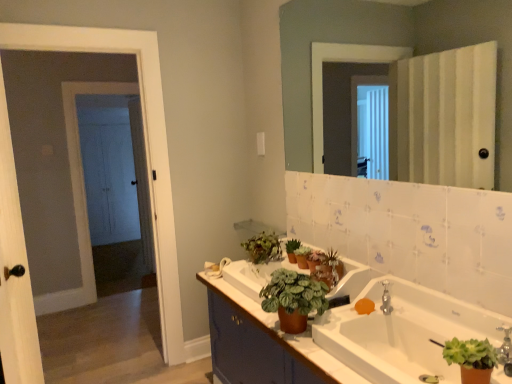
Measure the distance between green matte plant at lower right, which ranks as the first houseplant in right-to-left order, and camera.

green matte plant at lower right, which ranks as the first houseplant in right-to-left order, and camera are 1.13 meters apart.

Measure the distance between point (x=311, y=0) and camera.

Point (x=311, y=0) is 7.84 feet away from camera.

Identify the location of white wooden door at left. (82, 166).

Where is `green matte plant at upper center, the 2th houseplant when ordered from right to left`? This screenshot has width=512, height=384. green matte plant at upper center, the 2th houseplant when ordered from right to left is located at coordinates (292, 249).

Where is `green matte plant at center, which ranks as the second houseplant in back-to-front order`? green matte plant at center, which ranks as the second houseplant in back-to-front order is located at coordinates (263, 248).

Image resolution: width=512 pixels, height=384 pixels. What do you see at coordinates (263, 248) in the screenshot?
I see `green matte plant at center, the third houseplant when ordered from front to back` at bounding box center [263, 248].

Where is `green matte plant at lower right, which is the 1th houseplant in front-to-back order`? The image size is (512, 384). green matte plant at lower right, which is the 1th houseplant in front-to-back order is located at coordinates (471, 359).

Is green matte plant at upper center, the 2th houseplant when ordered from right to left, bigger or smaller than white matte towel bar at center?

green matte plant at upper center, the 2th houseplant when ordered from right to left, is smaller than white matte towel bar at center.

Considering the relative positions of green matte plant at upper center, the 2th houseplant when ordered from right to left, and white matte towel bar at center in the image provided, is green matte plant at upper center, the 2th houseplant when ordered from right to left, in front of white matte towel bar at center?

Yes, green matte plant at upper center, the 2th houseplant when ordered from right to left, is closer to the camera.

From a real-world perspective, which object stands above the other?

green matte plant at upper center, positioned as the first houseplant in back-to-front order, is physically above.

How far apart are green matte plant at upper center, the third houseplant from the left, and white matte towel bar at center?

14.64 inches.

In the scene shown: Does white wooden door at left have a greater width compared to green matte houseplant at center, which ranks as the second houseplant in front-to-back order?

Incorrect, the width of white wooden door at left does not surpass that of green matte houseplant at center, which ranks as the second houseplant in front-to-back order.

Is white wooden door at left spatially inside green matte houseplant at center, which ranks as the second houseplant in front-to-back order, or outside of it?

white wooden door at left is located beyond the bounds of green matte houseplant at center, which ranks as the second houseplant in front-to-back order.

Is white wooden door at left to the left of green matte houseplant at center, the third houseplant viewed from the back, from the viewer's perspective?

Yes.

You are a GUI agent. You are given a task and a screenshot of the screen. Output one action in this format:
    pyautogui.click(x=<x>, y=<y>)
    Task: Click on the tap located behind the brown matte cabinet at lower center
    Image resolution: width=512 pixels, height=384 pixels.
    Given the screenshot: What is the action you would take?
    pyautogui.click(x=386, y=299)

Which of these two, brown matte cabinet at lower center or silver metallic faucet at upper right, stands shorter?

Standing shorter between the two is silver metallic faucet at upper right.

From the image's perspective, which one is positioned lower, brown matte cabinet at lower center or silver metallic faucet at upper right?

brown matte cabinet at lower center, from the image's perspective.

Who is smaller, white wooden door at left or green matte plant at center, the third houseplant when ordered from front to back?

green matte plant at center, the third houseplant when ordered from front to back, is smaller.

At what (x,y) coordinates should I click in order to perform the action: click on houseplant that is the 1st one when counting rightward from the white wooden door at left. Please return your answer as a coordinate pair (x, y). Looking at the image, I should click on (263, 248).

Is white wooden door at left inside or outside of green matte plant at center, which ranks as the second houseplant in back-to-front order?

white wooden door at left is located beyond the bounds of green matte plant at center, which ranks as the second houseplant in back-to-front order.

Does white wooden door at left have a lesser width compared to green matte plant at center, which ranks as the second houseplant in back-to-front order?

Correct, the width of white wooden door at left is less than that of green matte plant at center, which ranks as the second houseplant in back-to-front order.

Between green matte plant at center, which ranks as the second houseplant in back-to-front order, and green matte plant at upper center, the 4th houseplant when ordered from front to back, which one has less height?

With less height is green matte plant at upper center, the 4th houseplant when ordered from front to back.

In the scene shown: Is green matte plant at center, which ranks as the second houseplant in back-to-front order, located outside green matte plant at upper center, the 4th houseplant when ordered from front to back?

Yes, green matte plant at center, which ranks as the second houseplant in back-to-front order, is not within green matte plant at upper center, the 4th houseplant when ordered from front to back.

Consider the image. From a real-world perspective, relative to green matte plant at upper center, positioned as the first houseplant in back-to-front order, is green matte plant at center, which appears as the first houseplant when viewed from the left, vertically above or below?

green matte plant at center, which appears as the first houseplant when viewed from the left, is situated higher than green matte plant at upper center, positioned as the first houseplant in back-to-front order, in the real world.

Is green matte houseplant at center, the third houseplant when ordered from right to left, surrounded by white glossy mirror at upper center?

No, white glossy mirror at upper center does not contain green matte houseplant at center, the third houseplant when ordered from right to left.

Which is behind, point (305, 30) or point (312, 298)?

Point (305, 30)

Based on the photo, considering the sizes of objects white glossy mirror at upper center and green matte houseplant at center, the third houseplant viewed from the back, in the image provided, who is wider, white glossy mirror at upper center or green matte houseplant at center, the third houseplant viewed from the back,?

green matte houseplant at center, the third houseplant viewed from the back.

Considering the sizes of objects white glossy mirror at upper center and green matte houseplant at center, the third houseplant viewed from the back, in the image provided, who is bigger, white glossy mirror at upper center or green matte houseplant at center, the third houseplant viewed from the back,?

Bigger between the two is white glossy mirror at upper center.

From the picture: Is green matte houseplant at center, the third houseplant viewed from the back, next to green matte plant at lower right, arranged as the fourth houseplant when viewed from the back?

No, green matte houseplant at center, the third houseplant viewed from the back, is not next to green matte plant at lower right, arranged as the fourth houseplant when viewed from the back.

Considering the sizes of objects green matte houseplant at center, the second houseplant viewed from the left, and green matte plant at lower right, which is the 1th houseplant in front-to-back order, in the image provided, who is bigger, green matte houseplant at center, the second houseplant viewed from the left, or green matte plant at lower right, which is the 1th houseplant in front-to-back order,?

green matte houseplant at center, the second houseplant viewed from the left, is bigger.

In the image, is green matte houseplant at center, which ranks as the second houseplant in front-to-back order, positioned in front of or behind green matte plant at lower right, which is the 1th houseplant in front-to-back order?

green matte houseplant at center, which ranks as the second houseplant in front-to-back order, is behind green matte plant at lower right, which is the 1th houseplant in front-to-back order.

Locate an element on the screen. The width and height of the screenshot is (512, 384). the 1st houseplant directly above the white matte towel bar at center (from a real-world perspective) is located at coordinates (292, 249).

Find the location of `door located behind the green matte houseplant at center, which ranks as the second houseplant in front-to-back order`. door located behind the green matte houseplant at center, which ranks as the second houseplant in front-to-back order is located at coordinates (82, 166).

Based on their spatial positions, is silver metallic faucet at upper right or white glossy mirror at upper center further from white matte towel bar at center?

white glossy mirror at upper center.

From the image, which object appears to be farther from white wooden door at left, white wood screen door at left or green matte plant at lower right, arranged as the fourth houseplant when viewed from the back?

green matte plant at lower right, arranged as the fourth houseplant when viewed from the back, is positioned further to the anchor white wooden door at left.

Looking at the image, which one is located closer to green matte houseplant at center, the third houseplant when ordered from right to left, green matte plant at lower right, arranged as the fourth houseplant when viewed from the back, or white glossy mirror at upper center?

Based on the image, green matte plant at lower right, arranged as the fourth houseplant when viewed from the back, appears to be nearer to green matte houseplant at center, the third houseplant when ordered from right to left.

Which object lies further to the anchor point white matte towel bar at center, green matte plant at upper center, the 2th houseplant when ordered from right to left, or brown matte cabinet at lower center?

Based on the image, brown matte cabinet at lower center appears to be further to white matte towel bar at center.

Looking at the image, which one is located closer to green matte plant at center, the fourth houseplant in the right-to-left sequence, white wooden door at left or green matte houseplant at center, which ranks as the second houseplant in front-to-back order?

green matte houseplant at center, which ranks as the second houseplant in front-to-back order, is closer to green matte plant at center, the fourth houseplant in the right-to-left sequence.

In the scene shown: Looking at the image, which one is located closer to green matte plant at upper center, the third houseplant from the left, green matte plant at lower right, the fourth houseplant when ordered from left to right, or white wooden door at left?

green matte plant at lower right, the fourth houseplant when ordered from left to right, is positioned closer to the anchor green matte plant at upper center, the third houseplant from the left.

Considering their positions, is white glossy mirror at upper center positioned further to green matte plant at upper center, the 2th houseplant when ordered from right to left, than green matte plant at center, the third houseplant when ordered from front to back?

white glossy mirror at upper center is further to green matte plant at upper center, the 2th houseplant when ordered from right to left.

Considering their positions, is green matte plant at center, which ranks as the second houseplant in back-to-front order, positioned further to white glossy mirror at upper center than green matte plant at lower right, which ranks as the first houseplant in right-to-left order?

green matte plant at center, which ranks as the second houseplant in back-to-front order, lies further to white glossy mirror at upper center than the other object.

What are the coordinates of `towel bar positioned between white wood screen door at left and white wooden door at left from near to far` in the screenshot? It's located at (216, 267).

This screenshot has width=512, height=384. What are the coordinates of `houseplant between green matte plant at lower right, which is the 1th houseplant in front-to-back order, and orange matte soap at sink from front to back` in the screenshot? It's located at (294, 298).

Identify the location of bathroom cabinet located between white wood screen door at left and orange matte soap at sink in the left-right direction. (345, 337).

I want to click on soap positioned between white glossy mirror at upper center and white wooden door at left from near to far, so click(x=364, y=306).